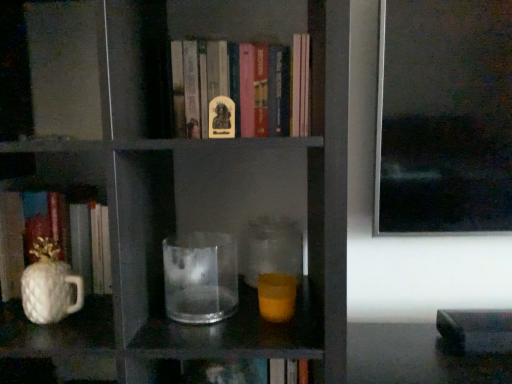
Question: Considering the relative positions of white glossy pineapple-shaped object at left, marked as the first book in a bottom-to-top arrangement, and white glossy pineapple-shaped mug at left in the image provided, is white glossy pineapple-shaped object at left, marked as the first book in a bottom-to-top arrangement, in front of white glossy pineapple-shaped mug at left?

Choices:
 (A) yes
 (B) no

Answer: (B)

Question: Does white glossy pineapple-shaped object at left, marked as the first book in a bottom-to-top arrangement, turn towards white glossy pineapple-shaped mug at left?

Choices:
 (A) yes
 (B) no

Answer: (A)

Question: Is white glossy pineapple-shaped object at left, marked as the first book in a bottom-to-top arrangement, placed right next to white glossy pineapple-shaped mug at left?

Choices:
 (A) no
 (B) yes

Answer: (B)

Question: Considering the relative sizes of white glossy pineapple-shaped object at left, marked as the first book in a bottom-to-top arrangement, and white glossy pineapple-shaped mug at left in the image provided, is white glossy pineapple-shaped object at left, marked as the first book in a bottom-to-top arrangement, shorter than white glossy pineapple-shaped mug at left?

Choices:
 (A) yes
 (B) no

Answer: (B)

Question: From a real-world perspective, is white glossy pineapple-shaped object at left, the 1th book viewed from the left, under white glossy pineapple-shaped mug at left?

Choices:
 (A) yes
 (B) no

Answer: (B)

Question: Does white glossy pineapple-shaped object at left, the 1th book viewed from the left, have a smaller size compared to white glossy pineapple-shaped mug at left?

Choices:
 (A) no
 (B) yes

Answer: (A)

Question: From a real-world perspective, is transparent glass jar at center beneath white glossy pineapple-shaped object at left, which is counted as the second book, starting from the right?

Choices:
 (A) no
 (B) yes

Answer: (B)

Question: From the image's perspective, does transparent glass jar at center appear higher than white glossy pineapple-shaped object at left, the 1th book viewed from the left?

Choices:
 (A) yes
 (B) no

Answer: (B)

Question: Is transparent glass jar at center further to camera compared to white glossy pineapple-shaped object at left, the 1th book viewed from the left?

Choices:
 (A) yes
 (B) no

Answer: (A)

Question: Can you confirm if transparent glass jar at center is smaller than white glossy pineapple-shaped object at left, which is counted as the 2th book, starting from the top?

Choices:
 (A) no
 (B) yes

Answer: (B)

Question: Is transparent glass jar at center far from white glossy pineapple-shaped object at left, marked as the first book in a bottom-to-top arrangement?

Choices:
 (A) no
 (B) yes

Answer: (A)

Question: Is transparent glass jar at center aimed at white glossy pineapple-shaped object at left, marked as the first book in a bottom-to-top arrangement?

Choices:
 (A) no
 (B) yes

Answer: (A)

Question: Is transparent glass jar at center a part of transparent glass at center?

Choices:
 (A) yes
 (B) no

Answer: (B)